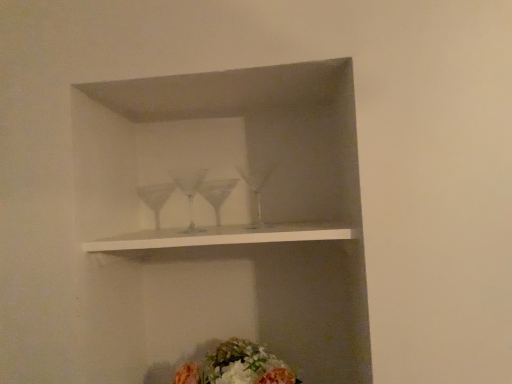
The height and width of the screenshot is (384, 512). What are the coordinates of `fluffy floral bouquet at lower center` in the screenshot? It's located at (237, 366).

The image size is (512, 384). What do you see at coordinates (237, 366) in the screenshot?
I see `fluffy floral bouquet at lower center` at bounding box center [237, 366].

Find the location of `white matte shelf at center`. white matte shelf at center is located at coordinates (222, 236).

This screenshot has height=384, width=512. What do you see at coordinates (222, 236) in the screenshot?
I see `white matte shelf at center` at bounding box center [222, 236].

The width and height of the screenshot is (512, 384). In order to click on fluffy floral bouquet at lower center in this screenshot , I will do `click(237, 366)`.

Visually, is fluffy floral bouquet at lower center positioned to the left or to the right of white matte shelf at center?

Clearly, fluffy floral bouquet at lower center is on the right of white matte shelf at center in the image.

Is fluffy floral bouquet at lower center positioned behind white matte shelf at center?

Yes, fluffy floral bouquet at lower center is further from the viewer.

Considering the points (219, 382) and (331, 233), which point is in front, point (219, 382) or point (331, 233)?

The point (331, 233) is more forward.

From the image's perspective, is fluffy floral bouquet at lower center under white matte shelf at center?

Correct, fluffy floral bouquet at lower center appears lower than white matte shelf at center in the image.

Consider the image. From a real-world perspective, is fluffy floral bouquet at lower center under white matte shelf at center?

Yes, from a real-world perspective, fluffy floral bouquet at lower center is beneath white matte shelf at center.

Does fluffy floral bouquet at lower center have a lesser width compared to white matte shelf at center?

Correct, the width of fluffy floral bouquet at lower center is less than that of white matte shelf at center.

Does fluffy floral bouquet at lower center have a greater height compared to white matte shelf at center?

Correct, fluffy floral bouquet at lower center is much taller as white matte shelf at center.

Who is smaller, fluffy floral bouquet at lower center or white matte shelf at center?

With smaller size is white matte shelf at center.

Can white matte shelf at center be found inside fluffy floral bouquet at lower center?

Actually, white matte shelf at center is outside fluffy floral bouquet at lower center.

From the picture: Is there a large distance between fluffy floral bouquet at lower center and white matte shelf at center?

fluffy floral bouquet at lower center is actually quite close to white matte shelf at center.

Is fluffy floral bouquet at lower center facing away from white matte shelf at center?

That's not correct — fluffy floral bouquet at lower center is not looking away from white matte shelf at center.

Can you tell me how much fluffy floral bouquet at lower center and white matte shelf at center differ in facing direction?

The angle between the facing direction of fluffy floral bouquet at lower center and the facing direction of white matte shelf at center is 2.2 degrees.

Locate an element on the screen. flower below the white matte shelf at center (from the image's perspective) is located at coordinates (237, 366).

Can you confirm if white matte shelf at center is positioned to the left of fluffy floral bouquet at lower center?

Yes.

Is white matte shelf at center further to the viewer compared to fluffy floral bouquet at lower center?

No, white matte shelf at center is in front of fluffy floral bouquet at lower center.

Is point (318, 236) behind point (213, 352)?

No, it is not.

From the image's perspective, would you say white matte shelf at center is positioned over fluffy floral bouquet at lower center?

Indeed, from the image's perspective, white matte shelf at center is shown above fluffy floral bouquet at lower center.

From a real-world perspective, is white matte shelf at center on fluffy floral bouquet at lower center?

Yes, from a real-world perspective, white matte shelf at center is on top of fluffy floral bouquet at lower center.

Which of these two, white matte shelf at center or fluffy floral bouquet at lower center, is wider?

With larger width is white matte shelf at center.

Does white matte shelf at center have a greater height compared to fluffy floral bouquet at lower center?

In fact, white matte shelf at center may be shorter than fluffy floral bouquet at lower center.

Who is bigger, white matte shelf at center or fluffy floral bouquet at lower center?

With larger size is fluffy floral bouquet at lower center.

Is fluffy floral bouquet at lower center a part of white matte shelf at center?

Actually, fluffy floral bouquet at lower center is outside white matte shelf at center.

Are white matte shelf at center and fluffy floral bouquet at lower center located far from each other?

No, white matte shelf at center is not far away from fluffy floral bouquet at lower center.

Could you tell me if white matte shelf at center is turned towards fluffy floral bouquet at lower center?

No, white matte shelf at center does not turn towards fluffy floral bouquet at lower center.

In the scene shown: How many degrees apart are the facing directions of white matte shelf at center and fluffy floral bouquet at lower center?

They differ by 2.2 degrees in their facing directions.

At what (x,y) coordinates should I click in order to perform the action: click on flower behind the white matte shelf at center. Please return your answer as a coordinate pair (x, y). Looking at the image, I should click on (237, 366).

Locate an element on the screen. The height and width of the screenshot is (384, 512). flower that is under the white matte shelf at center (from a real-world perspective) is located at coordinates (237, 366).

At what (x,y) coordinates should I click in order to perform the action: click on shelf on the left of fluffy floral bouquet at lower center. Please return your answer as a coordinate pair (x, y). This screenshot has width=512, height=384. Looking at the image, I should click on (222, 236).